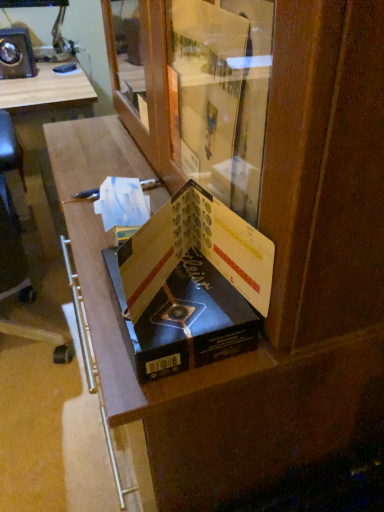
Question: Considering the relative positions of matte black book at center, marked as the second paperback book in a back-to-front arrangement, and matte black book at center, which is the first paperback book in back-to-front order, in the image provided, is matte black book at center, marked as the second paperback book in a back-to-front arrangement, to the left or to the right of matte black book at center, which is the first paperback book in back-to-front order,?

Choices:
 (A) right
 (B) left

Answer: (A)

Question: From a real-world perspective, is matte black book at center, which is the 1th paperback book from front to back, physically located above or below matte black book at center, which is the first paperback book in back-to-front order?

Choices:
 (A) above
 (B) below

Answer: (A)

Question: Considering the positions of point click(135, 251) and point click(241, 313), is point click(135, 251) closer or farther from the camera than point click(241, 313)?

Choices:
 (A) farther
 (B) closer

Answer: (B)

Question: Does point (236, 351) appear closer or farther from the camera than point (256, 264)?

Choices:
 (A) farther
 (B) closer

Answer: (A)

Question: Considering their positions, is matte black book at center, the 2th paperback book from the front, located in front of or behind matte black book at center, marked as the second paperback book in a back-to-front arrangement?

Choices:
 (A) front
 (B) behind

Answer: (B)

Question: Do you think matte black book at center, the 2th paperback book from the front, is within matte black book at center, marked as the second paperback book in a back-to-front arrangement, or outside of it?

Choices:
 (A) outside
 (B) inside

Answer: (A)

Question: From a real-world perspective, is matte black book at center, which is the first paperback book in back-to-front order, positioned above or below matte black book at center, marked as the second paperback book in a back-to-front arrangement?

Choices:
 (A) below
 (B) above

Answer: (A)